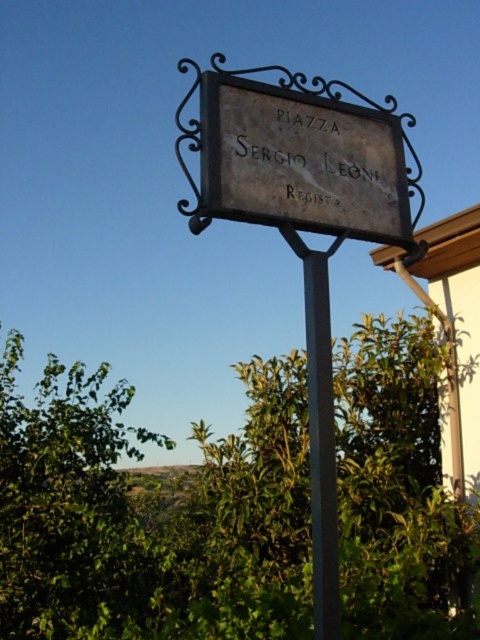
You are standing in front of the dark gray stone sign at center and the metallic pole at center. Which object is closer to you?

The dark gray stone sign at center is closer to you since it is positioned further to the viewer than the metallic pole at center.

You are standing next to a camera that is 2 meters wide. You want to take a photo of the dark gray metal sign at center. Can your camera fit the entire sign in the frame if the camera has a field of view that can capture 4 meters width at this distance?

The distance between the dark gray metal sign at center and the camera is 3.50 meters. The camera can capture 4 meters width at this distance, so yes, the camera can fit the entire dark gray metal sign at center in the frame since 4 meters is wider than the required 3.50 meters.